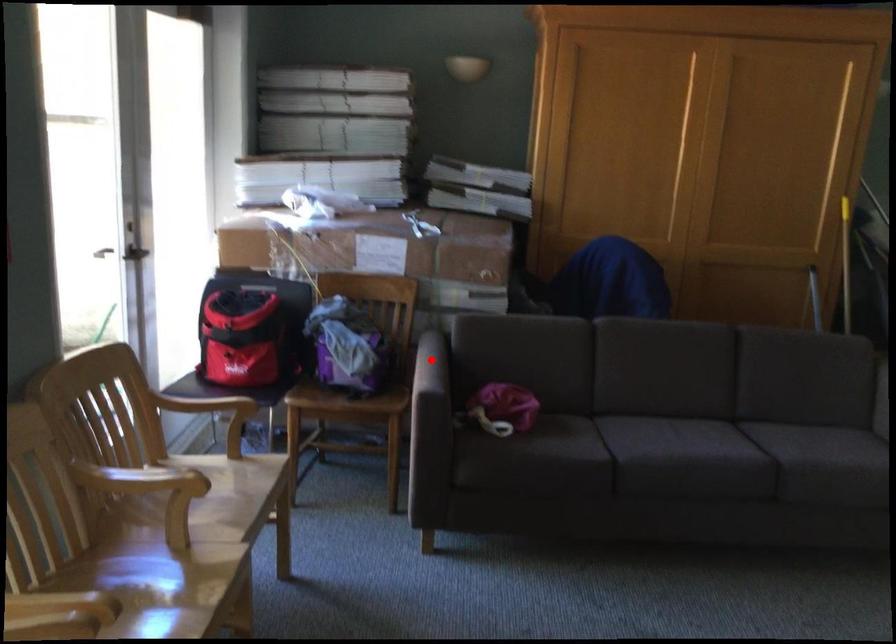
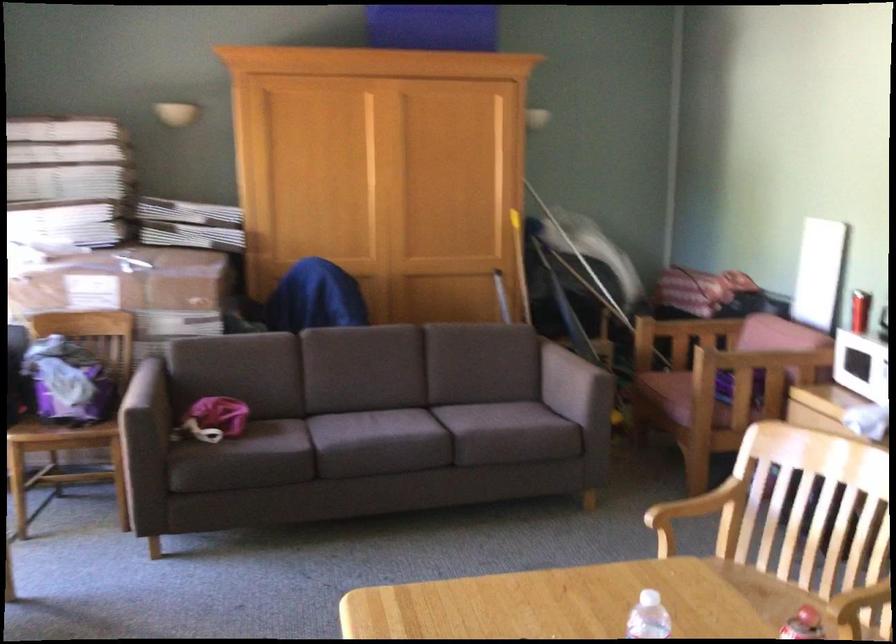
Locate, in the second image, the point that corresponds to the highlighted location in the first image.

(144, 386)